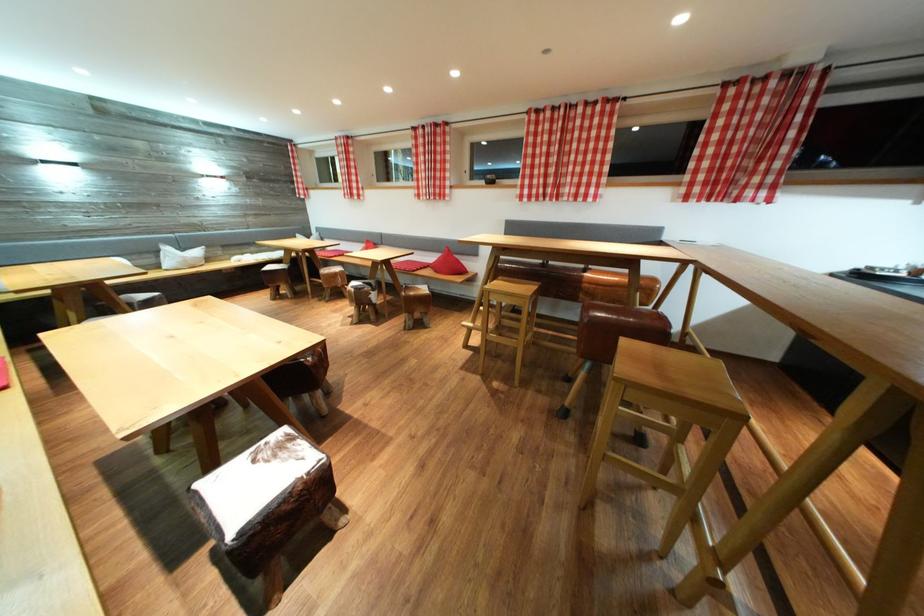
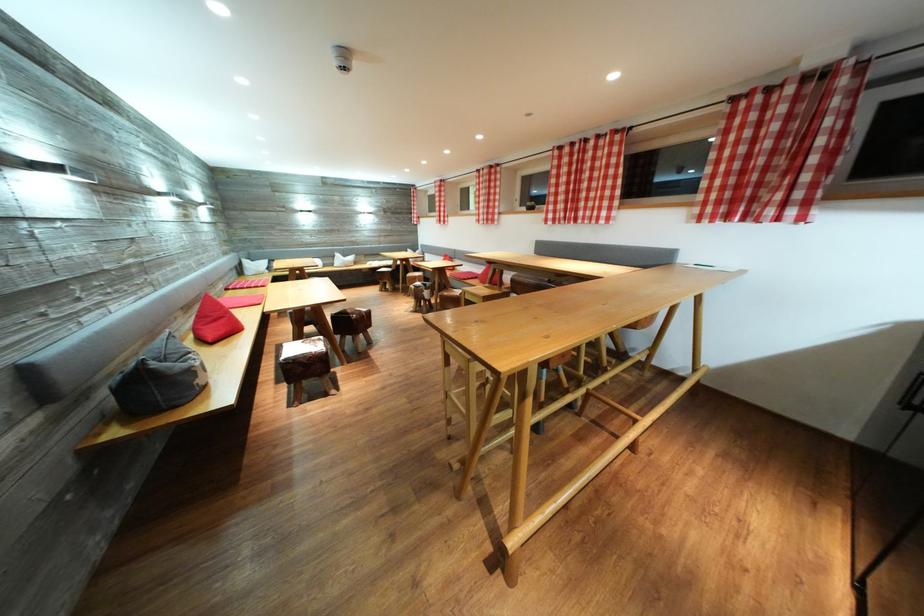
In the second image, find the point that corresponds to point 532,197 in the first image.

(556, 222)